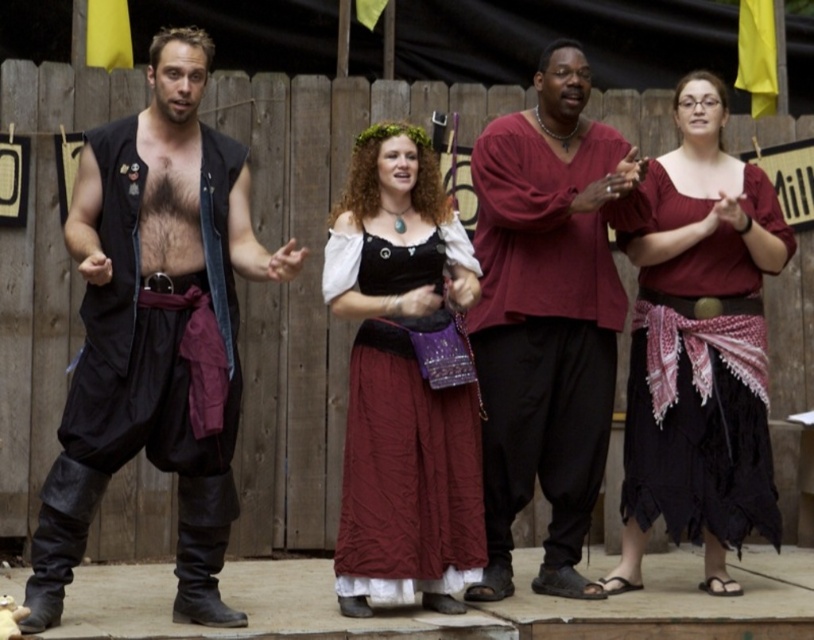
You are designing a costume for a play and need to choose between the leather vest at left and the maroon fabric shirt at center. If the character requires a larger garment to accommodate padding for armor underneath, which option should you choose?

The leather vest at left is larger in size than the maroon fabric shirt at center, so it would be the better choice for accommodating padding underneath.

You are a costume designer preparing for a historical play. You need to ensure that the actors can move freely between the leather vest at left and the velvet black dress at center during a scene. The actors have a maximum reach of 1.2 meters. Can they comfortably pass the costume pieces between each other without moving their positions?

The distance between the leather vest at left and the velvet black dress at center is 1.27 meters. Since the actors can only reach up to 1.2 meters, they cannot comfortably pass the costume pieces between each other without moving closer.